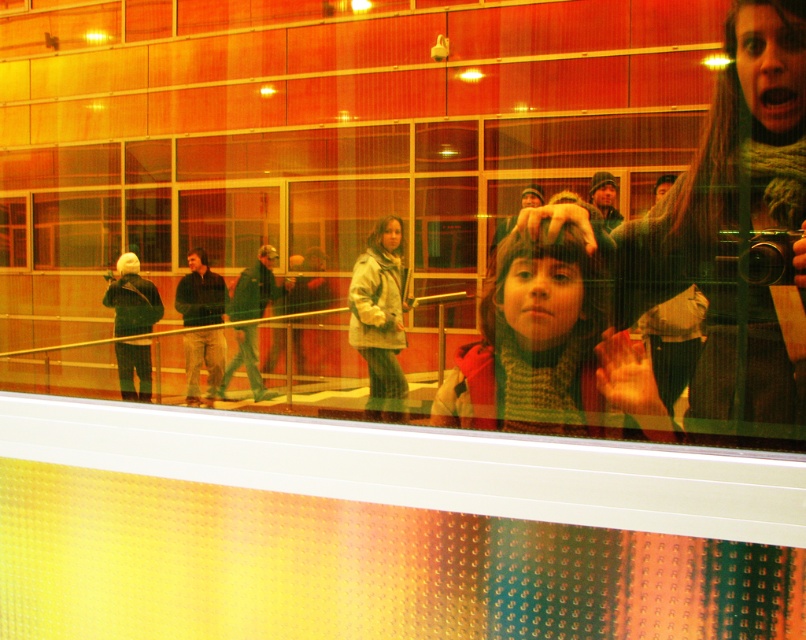
You are standing at the glass barrier in the ice skating rink and want to hand a knitted scarf at right to someone behind you. Can you reach it without moving your feet?

The knitted scarf at right is 4.24 feet away from you, which is beyond typical human arm reach. You would need to move your feet to retrieve it.

You are a photographer trying to capture both the knitted scarf at right and the knitted scarf at center in a single shot. Based on their widths, which scarf should you focus on to ensure both fit in the frame?

The knitted scarf at right might be wider than the knitted scarf at center, so focusing on the knitted scarf at right would ensure both fit in the frame.